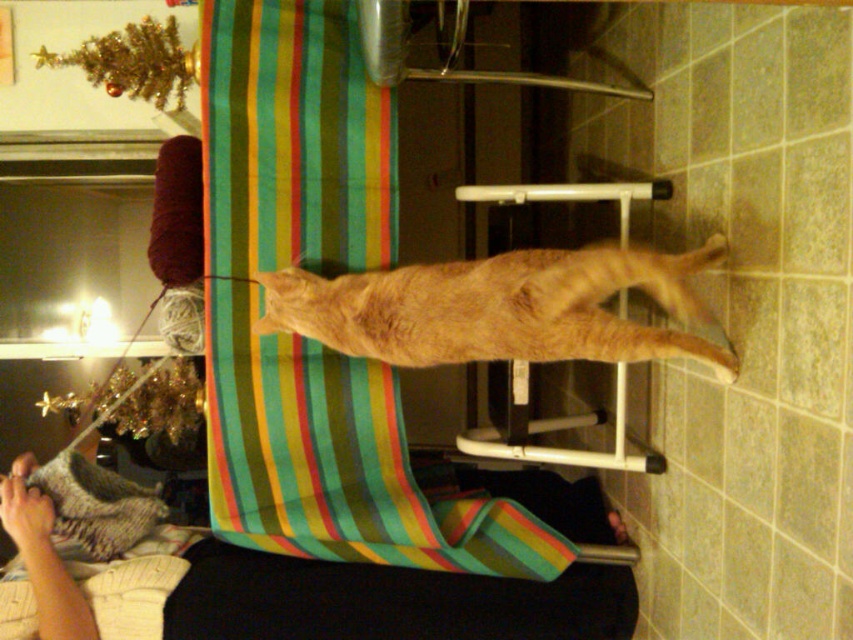
Question: Can you confirm if soft beige sweater at lower left is thinner than orange fur cat at center?

Choices:
 (A) no
 (B) yes

Answer: (A)

Question: Which point is closer to the camera?

Choices:
 (A) soft beige sweater at lower left
 (B) multicolored striped fabric at center

Answer: (A)

Question: Can you confirm if soft beige sweater at lower left is bigger than orange fur cat at center?

Choices:
 (A) no
 (B) yes

Answer: (B)

Question: In this image, where is multicolored striped fabric at center located relative to orange fur cat at center?

Choices:
 (A) right
 (B) left

Answer: (B)

Question: Which is farther from the multicolored striped fabric at center?

Choices:
 (A) orange fur cat at center
 (B) soft beige sweater at lower left

Answer: (B)

Question: Estimate the real-world distances between objects in this image. Which object is closer to the soft beige sweater at lower left?

Choices:
 (A) orange fur cat at center
 (B) multicolored striped fabric at center

Answer: (B)